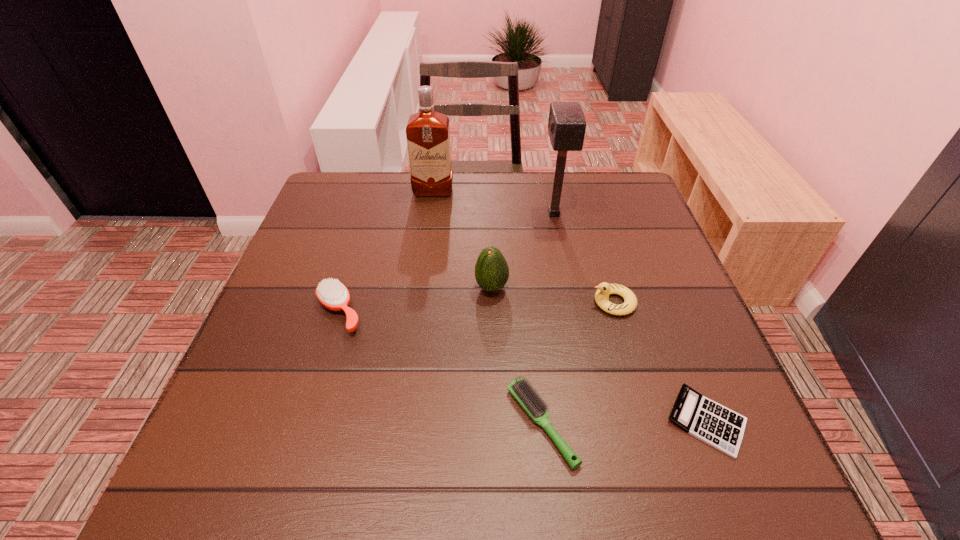
The width and height of the screenshot is (960, 540). I want to click on free region at the left edge of the desktop, so click(x=318, y=387).

Locate an element on the screen. free space at the right edge is located at coordinates (607, 264).

Identify the location of vacant area at the far right corner. The height and width of the screenshot is (540, 960). (596, 208).

The width and height of the screenshot is (960, 540). Find the location of `vacant region between the duckling and the third tallest object`. vacant region between the duckling and the third tallest object is located at coordinates (552, 295).

Image resolution: width=960 pixels, height=540 pixels. Find the location of `unoccupied area between the duckling and the shorter hairbrush`. unoccupied area between the duckling and the shorter hairbrush is located at coordinates (578, 363).

The width and height of the screenshot is (960, 540). I want to click on free space between the left hairbrush and the fourth tallest object, so [x=476, y=307].

The height and width of the screenshot is (540, 960). I want to click on vacant area that lies between the calculator and the third object from right to left, so click(630, 318).

I want to click on free point between the shorter hairbrush and the calculator, so click(x=624, y=423).

Identify the location of free space between the taller hairbrush and the shortest object. The height and width of the screenshot is (540, 960). (523, 367).

This screenshot has width=960, height=540. Identify the location of vacant point located between the duckling and the calculator. (660, 362).